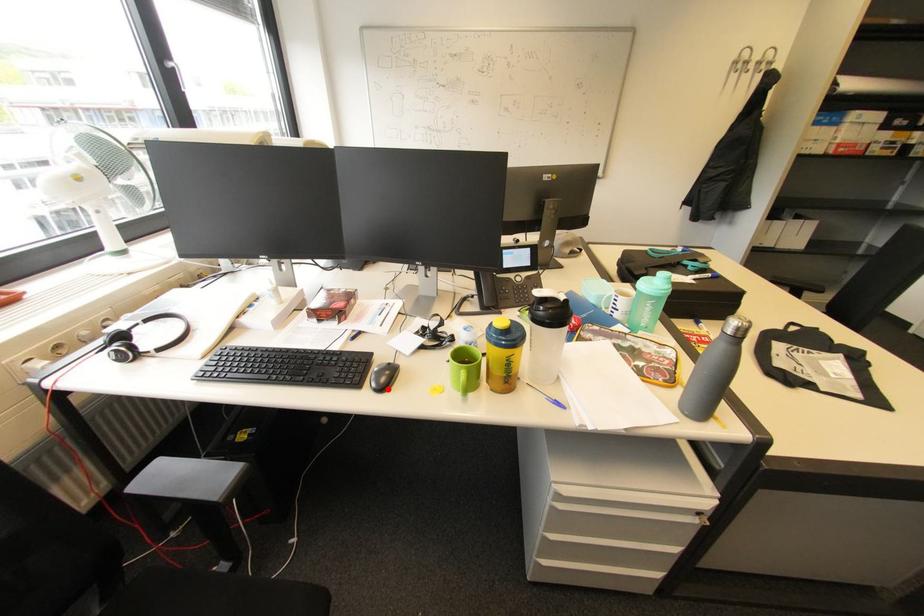
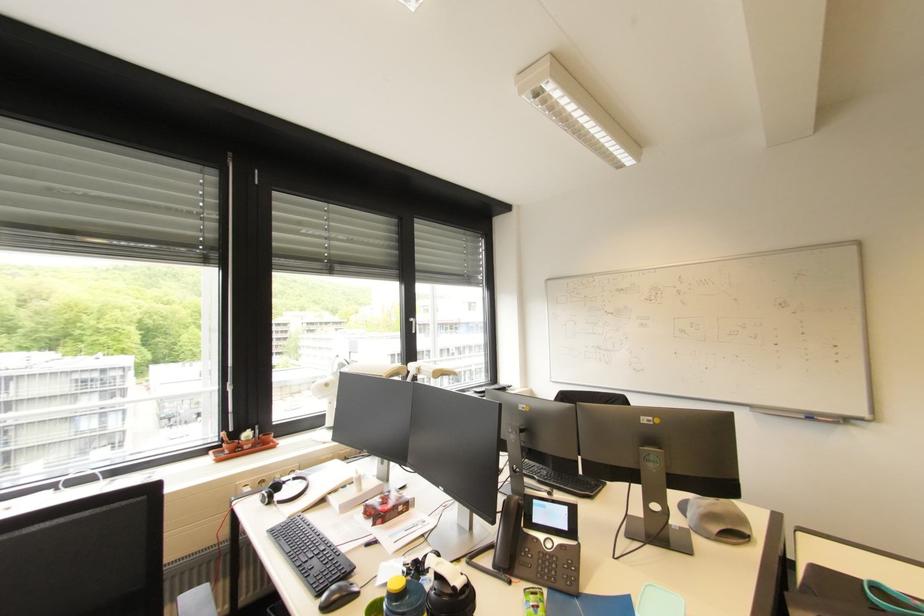
Where in the second image is the point corresponding to the highlighted location from the first image?

(332, 609)